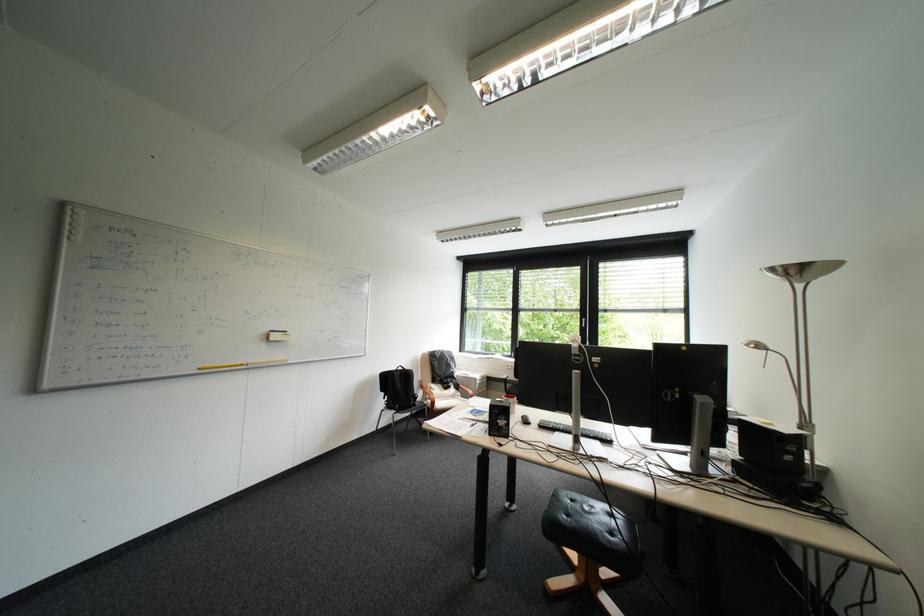
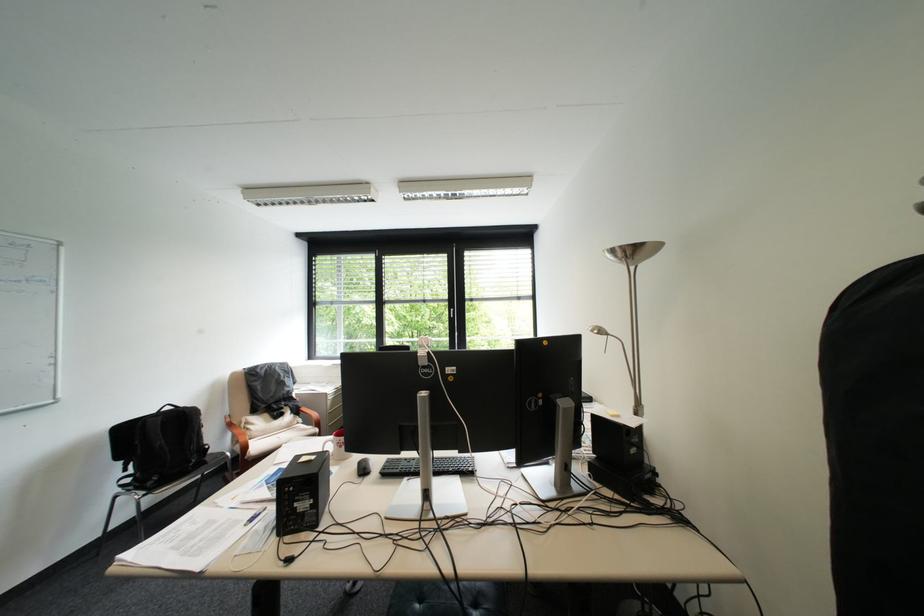
In the second image, find the point that corresponds to point 785,270 in the first image.

(625, 252)